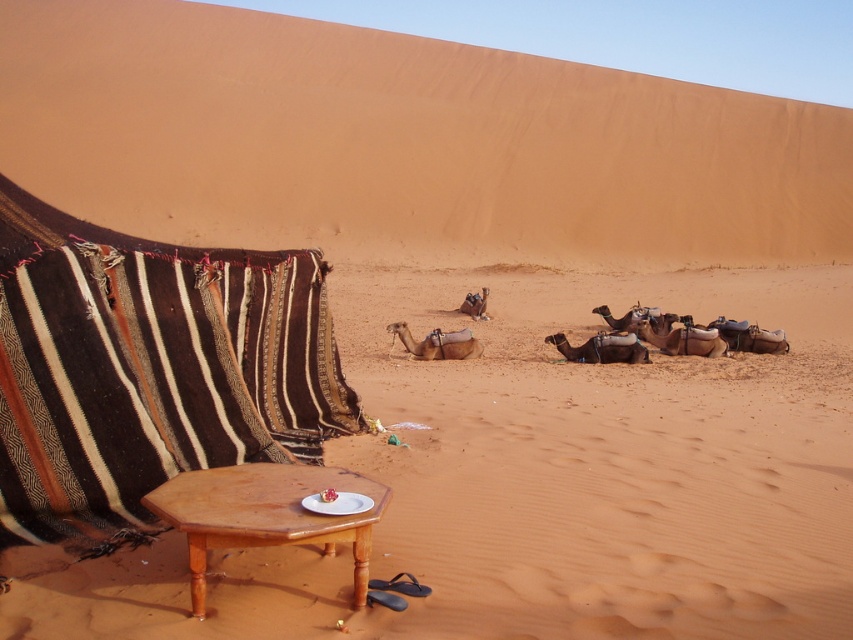
You are a traveler in the desert and need to place a 6 feet long tent pole between the sandy yellow sand at center and the brown striped fabric at left. Will the pole fit between them?

The distance between the sandy yellow sand at center and the brown striped fabric at left is 5.92 feet, which is shorter than the 6 feet long tent pole. Therefore, the pole will not fit between them.

You are standing in the desert scene and want to reach the brown wooden table at lower center. Which direction should you move relative to the sandy yellow sand at center to get there?

To reach the brown wooden table at lower center, you should move towards the sandy yellow sand at center since it is closer to you than the table.